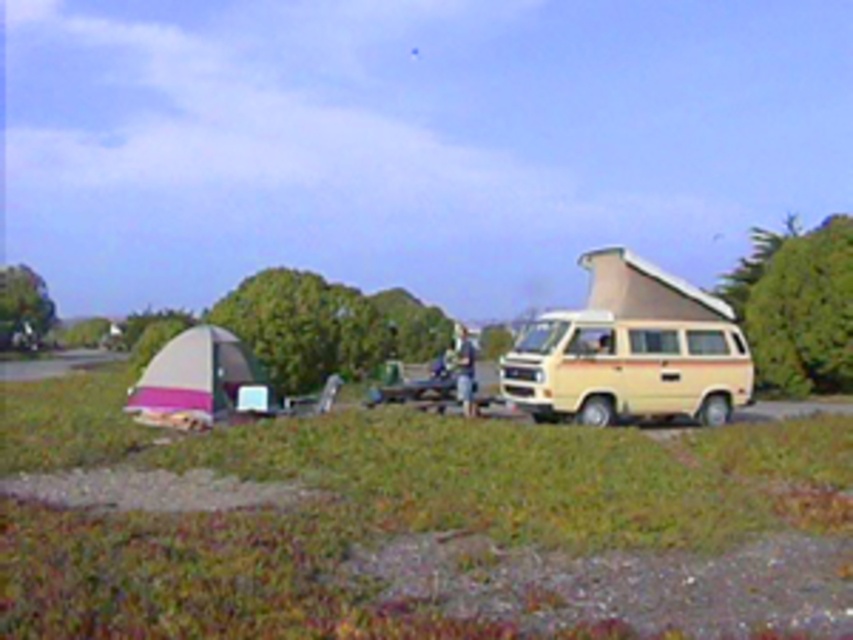
Based on the photo, can you confirm if beige/woodgrain van at right is positioned above light blue denim jeans at center?

Yes.

What do you see at coordinates (625, 369) in the screenshot?
I see `beige/woodgrain van at right` at bounding box center [625, 369].

Does point (521, 340) come farther from viewer compared to point (453, 348)?

No, (521, 340) is closer to viewer.

You are a GUI agent. You are given a task and a screenshot of the screen. Output one action in this format:
    pyautogui.click(x=<x>, y=<y>)
    Task: Click on the beige/woodgrain van at right
    
    Given the screenshot: What is the action you would take?
    pyautogui.click(x=625, y=369)

Does green grass at center have a greater height compared to beige/woodgrain van at right?

Yes.

Which is behind, point (514, 497) or point (666, 362)?

Point (666, 362)

At what (x,y) coordinates should I click in order to perform the action: click on green grass at center. Please return your answer as a coordinate pair (x, y). Looking at the image, I should click on (416, 525).

Is point (235, 339) more distant than point (465, 328)?

No, (235, 339) is closer to viewer.

Which is below, pink fabric tent at lower left or light blue denim jeans at center?

light blue denim jeans at center is below.

Where is `pink fabric tent at lower left`? Image resolution: width=853 pixels, height=640 pixels. pink fabric tent at lower left is located at coordinates (199, 381).